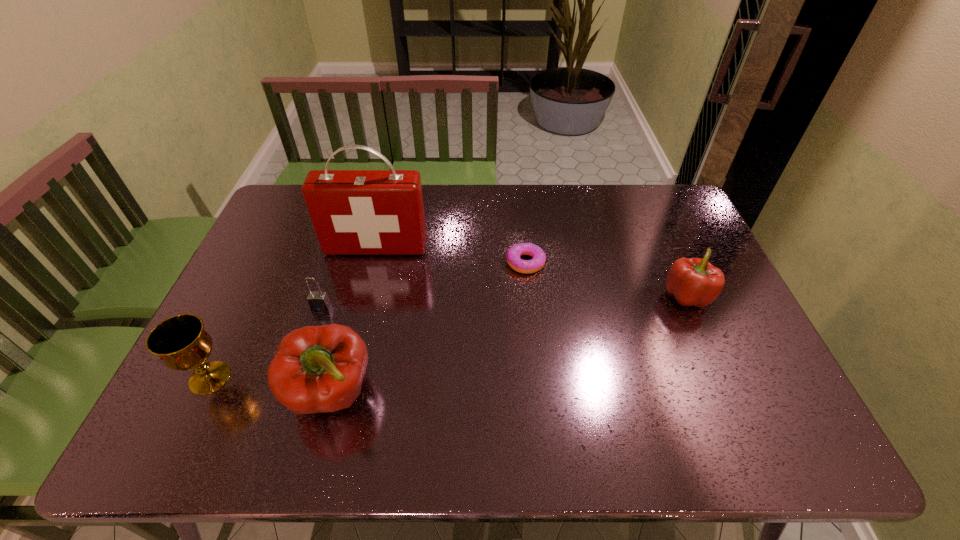
You are a GUI agent. You are given a task and a screenshot of the screen. Output one action in this format:
    pyautogui.click(x=<x>, y=<y>)
    Task: Click on the free region located on the front of the rightmost object
    The image size is (960, 540).
    Given the screenshot: What is the action you would take?
    pyautogui.click(x=708, y=345)

Where is `vacant area located on the front face of the tallest object`? vacant area located on the front face of the tallest object is located at coordinates (367, 288).

Find the location of `blank space located on the shackle of the padlock`. blank space located on the shackle of the padlock is located at coordinates (298, 377).

Find the location of a particular element. The image size is (960, 540). free space located on the left of the shortest object is located at coordinates (483, 262).

This screenshot has width=960, height=540. In order to click on vacant position located on the back of the leftmost object in this screenshot , I will do `click(270, 254)`.

Locate an element on the screen. The width and height of the screenshot is (960, 540). bell pepper located at the near edge is located at coordinates (316, 369).

Where is `chalice at the near edge`? This screenshot has width=960, height=540. chalice at the near edge is located at coordinates (181, 343).

This screenshot has height=540, width=960. I want to click on object that is at the left edge, so click(x=181, y=343).

The image size is (960, 540). Identify the location of object present at the right edge. (691, 281).

Locate an element on the screen. This screenshot has height=540, width=960. object situated at the near left corner is located at coordinates (181, 343).